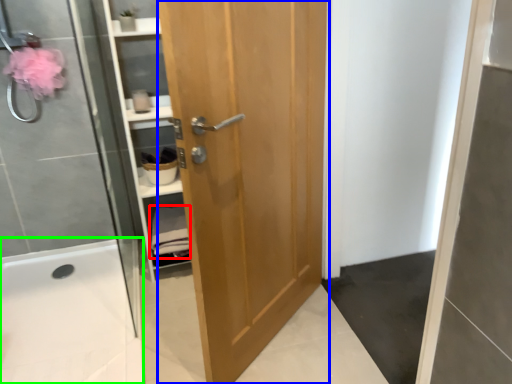
Question: Estimate the real-world distances between objects in this image. Which object is closer to material (highlighted by a red box), door (highlighted by a blue box) or bath (highlighted by a green box)?

Choices:
 (A) door
 (B) bath

Answer: (B)